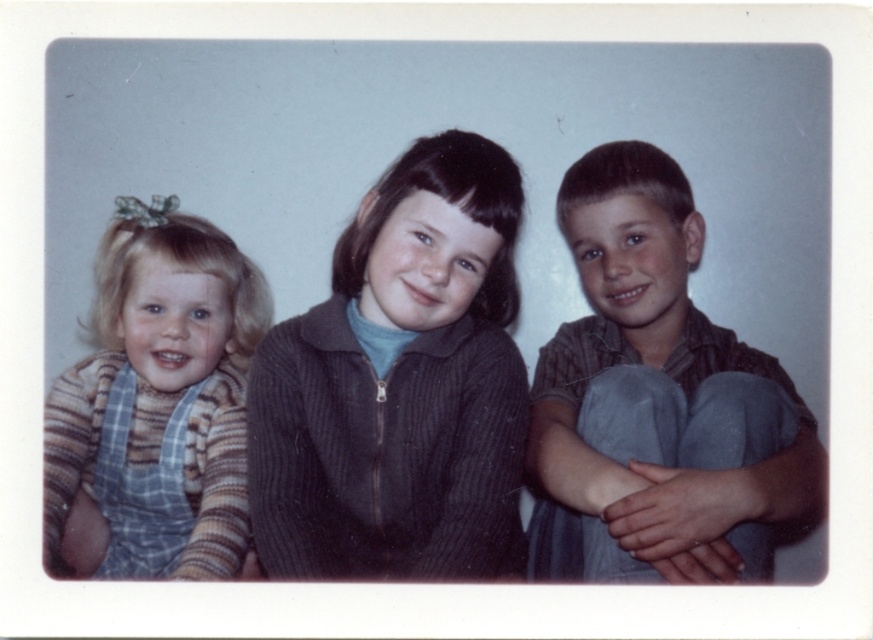
You are a photographer trying to focus on the striped knit sweater at left and the dark ribbed sweater at center. Which one should you adjust your camera focus to first if you want to capture both in sharp detail?

You should focus on the dark ribbed sweater at center first because it is closer to the viewer than the striped knit sweater at left. By focusing on the closer object, you can ensure both are in focus using the depth of field.

You are a photographer organizing a group photo. You need to arrange the children so that the matte brown shirt at right and the striped knit sweater at left are visible to the audience. Based on the scene description, which child should be positioned closer to the camera?

The matte brown shirt at right is in front of the striped knit sweater at left, so the child wearing the matte brown shirt at right should be positioned closer to the camera to ensure both are visible.

You are a photographer who needs to arrange the children in a new pose for a photo shoot. The current setup has the dark ribbed sweater at center and the matte brown shirt at right. If you want to swap their positions so the matte brown shirt is now at the center and the dark ribbed sweater moves to the right, which child should you move to the right side?

The dark ribbed sweater at center is currently to the left of the matte brown shirt at right. To swap their positions, you should move the dark ribbed sweater at center to the right side so it is positioned to the right of the matte brown shirt at right.